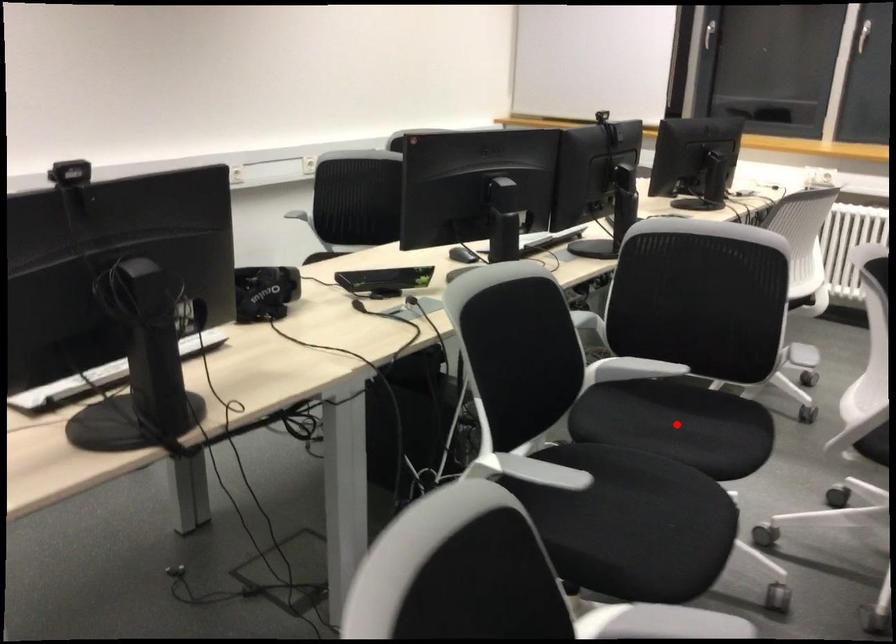
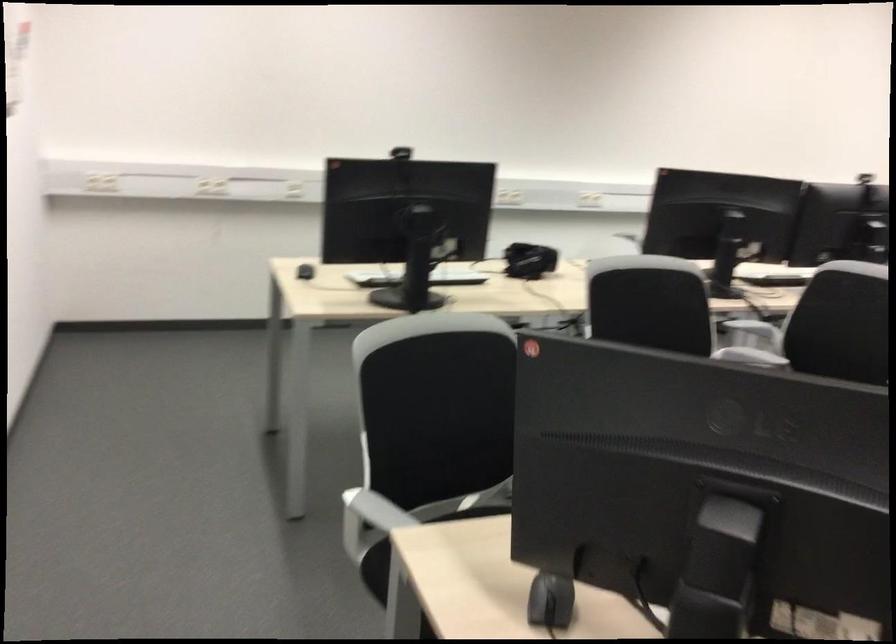
Question: I am providing you with two images of the same scene from different viewpoints. A red point is marked on the first image. Can you still see the location of the red point in image 2?

Choices:
 (A) Yes
 (B) No

Answer: (B)